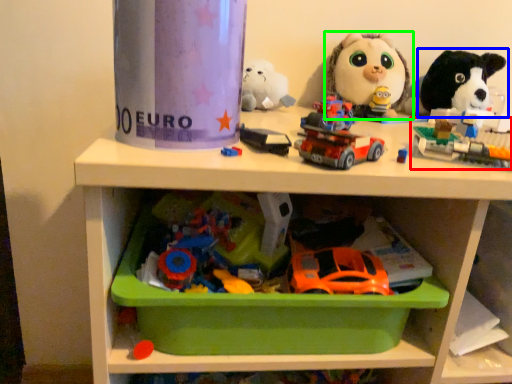
Question: Considering the real-world distances, which object is closest to toy (highlighted by a red box)? toy (highlighted by a blue box) or toy (highlighted by a green box).

Choices:
 (A) toy
 (B) toy

Answer: (A)